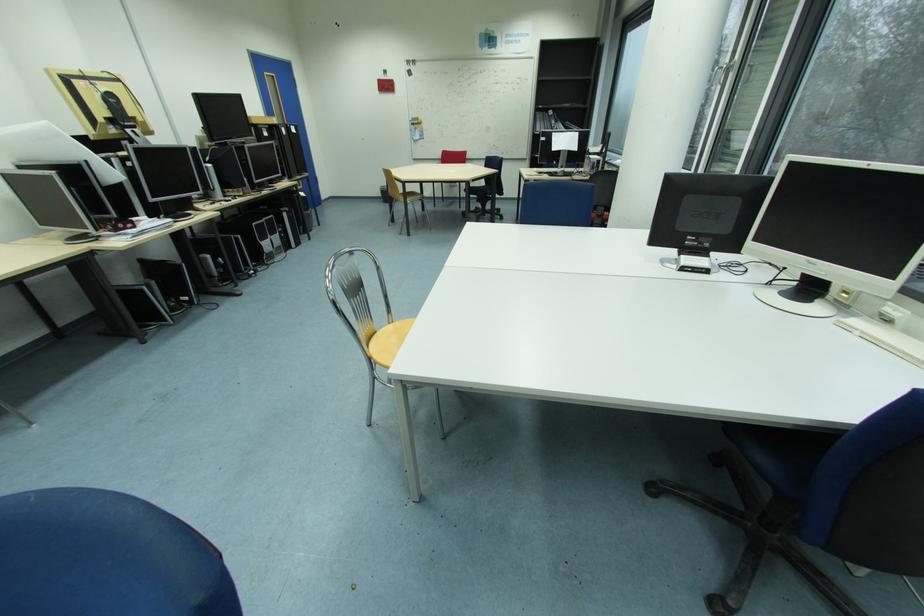
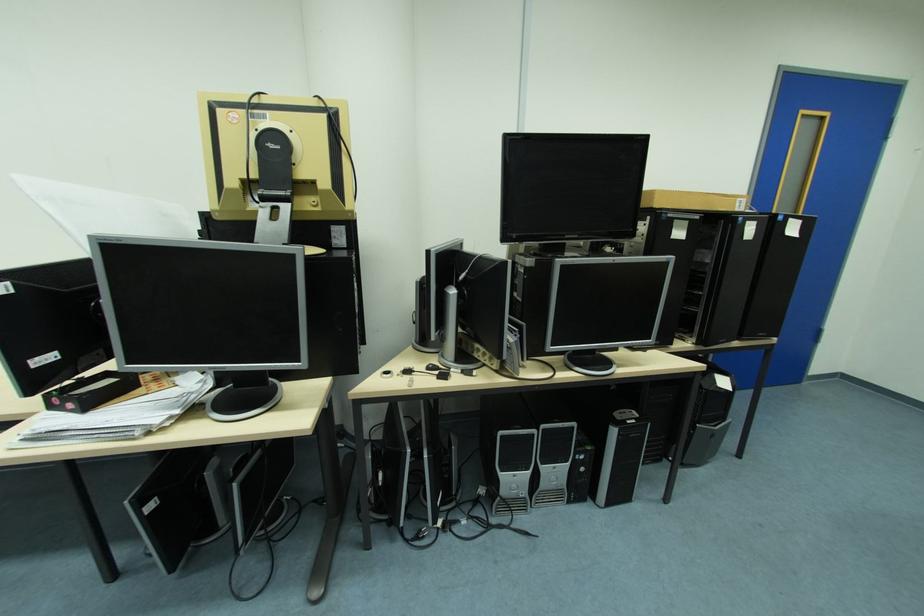
Where in the second image is the point corresponding to pixel 261 123 from the first image?

(664, 206)